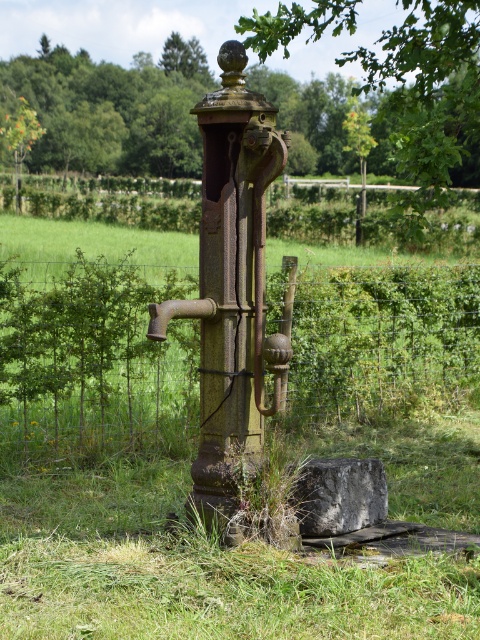
Is wire mesh fence at center shorter than green leafy tree at upper center?

Yes, wire mesh fence at center is shorter than green leafy tree at upper center.

Who is lower down, wire mesh fence at center or green leafy tree at upper center?

wire mesh fence at center is below.

Does point (126, 298) lie behind point (392, 35)?

No, it is not.

Locate an element on the screen. The width and height of the screenshot is (480, 640). wire mesh fence at center is located at coordinates coord(94,365).